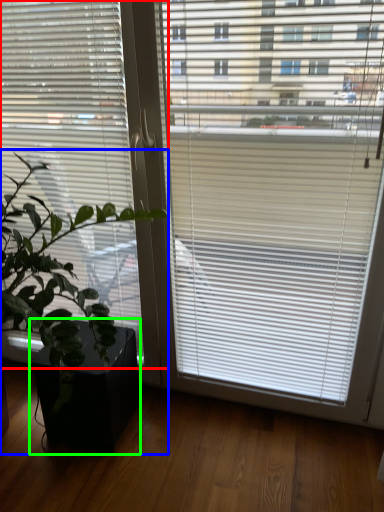
Question: Which object is positioned farthest from window blind (highlighted by a red box)? Select from houseplant (highlighted by a blue box) and flowerpot (highlighted by a green box).

Choices:
 (A) houseplant
 (B) flowerpot

Answer: (B)